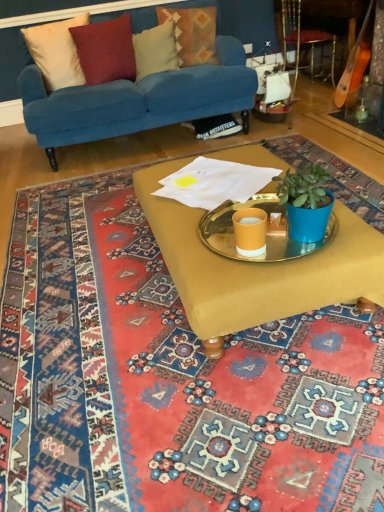
Question: From a real-world perspective, is velvet cushion at upper center, the 3th pillow from the left, physically below metallic tray at center?

Choices:
 (A) no
 (B) yes

Answer: (A)

Question: From the image's perspective, is velvet cushion at upper center, the 3th pillow from the left, below metallic tray at center?

Choices:
 (A) no
 (B) yes

Answer: (A)

Question: Is velvet cushion at upper center, the 3th pillow from the left, positioned beyond the bounds of metallic tray at center?

Choices:
 (A) no
 (B) yes

Answer: (B)

Question: Would you say metallic tray at center is part of velvet cushion at upper center, which is counted as the 2th pillow, starting from the right,'s contents?

Choices:
 (A) yes
 (B) no

Answer: (B)

Question: Is velvet cushion at upper center, the 3th pillow from the left, positioned before metallic tray at center?

Choices:
 (A) no
 (B) yes

Answer: (A)

Question: Is metallic tray at center in front of or behind metallic gold armchair at upper right in the image?

Choices:
 (A) front
 (B) behind

Answer: (A)

Question: Is metallic tray at center taller or shorter than metallic gold armchair at upper right?

Choices:
 (A) tall
 (B) short

Answer: (B)

Question: Is point (332, 227) positioned closer to the camera than point (289, 24)?

Choices:
 (A) farther
 (B) closer

Answer: (B)

Question: In terms of width, does metallic tray at center look wider or thinner when compared to metallic gold armchair at upper right?

Choices:
 (A) wide
 (B) thin

Answer: (A)

Question: From the image's perspective, relative to matte gold coffee table at center, is metallic gold armchair at upper right above or below?

Choices:
 (A) below
 (B) above

Answer: (B)

Question: In terms of width, does metallic gold armchair at upper right look wider or thinner when compared to matte gold coffee table at center?

Choices:
 (A) thin
 (B) wide

Answer: (A)

Question: Which is correct: metallic gold armchair at upper right is inside matte gold coffee table at center, or outside of it?

Choices:
 (A) inside
 (B) outside

Answer: (B)

Question: In terms of size, does metallic gold armchair at upper right appear bigger or smaller than matte gold coffee table at center?

Choices:
 (A) small
 (B) big

Answer: (A)

Question: Is textured woolen pillow at upper center, the first pillow viewed from the right, wider or thinner than wooden acoustic guitar at right?

Choices:
 (A) thin
 (B) wide

Answer: (A)

Question: Looking at the image, does textured woolen pillow at upper center, the first pillow viewed from the right, seem bigger or smaller compared to wooden acoustic guitar at right?

Choices:
 (A) big
 (B) small

Answer: (B)